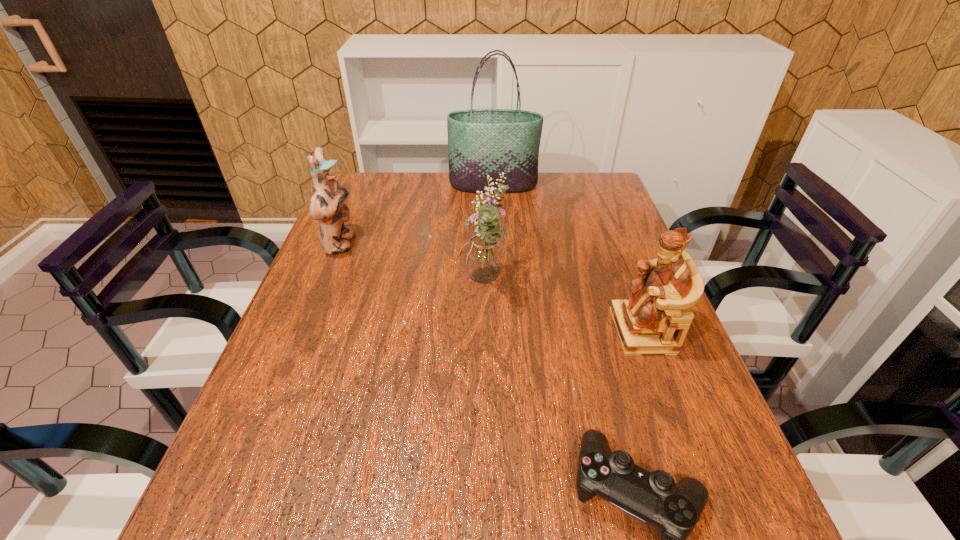
In the image, there is a desktop. What are the coordinates of `vacant area at the right edge` in the screenshot? It's located at (686, 390).

Find the location of a particular element. The width and height of the screenshot is (960, 540). vacant region at the near left corner is located at coordinates (258, 506).

Where is `vacant area at the far right corner of the desktop`? The image size is (960, 540). vacant area at the far right corner of the desktop is located at coordinates (589, 197).

The width and height of the screenshot is (960, 540). Identify the location of free space between the farther figurine and the farthest object. (417, 214).

Image resolution: width=960 pixels, height=540 pixels. Identify the location of vacant space that is in between the farther figurine and the farthest object. (417, 214).

The height and width of the screenshot is (540, 960). Find the location of `free space between the nearer figurine and the leftmost object`. free space between the nearer figurine and the leftmost object is located at coordinates [492, 287].

The height and width of the screenshot is (540, 960). Find the location of `empty space that is in between the nearer figurine and the tallest object`. empty space that is in between the nearer figurine and the tallest object is located at coordinates (568, 258).

I want to click on vacant space that is in between the farthest object and the right figurine, so point(568,258).

Where is `the closest object to the bouquet`? the closest object to the bouquet is located at coordinates 655,319.

Find the location of a particular element. the third closest object to the tote bag is located at coordinates (655, 319).